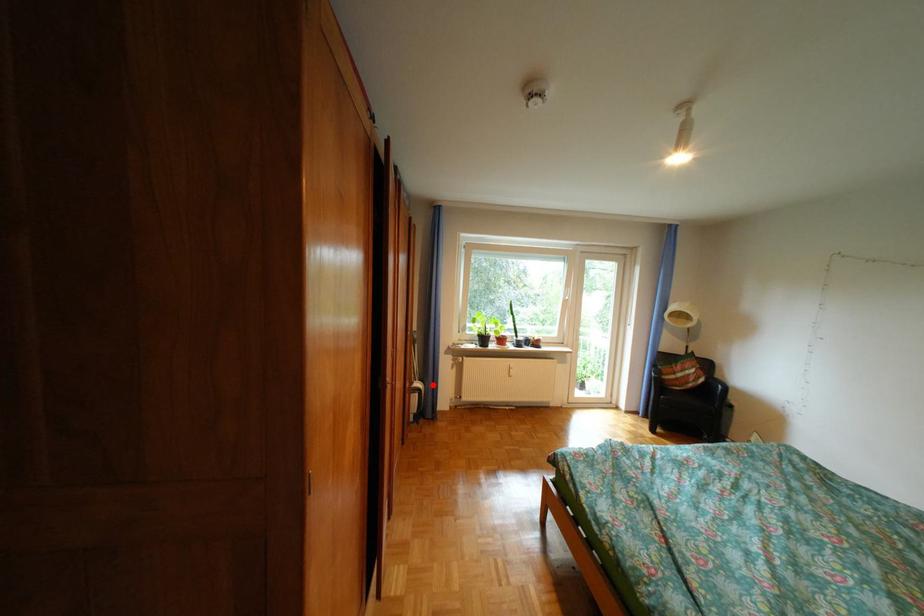
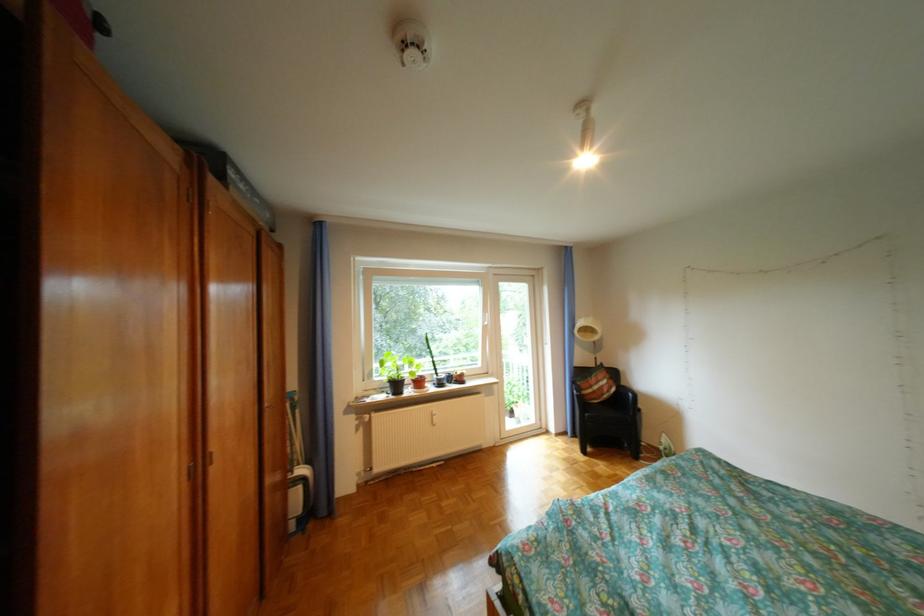
Find the pixel in the second image that matches the highlighted location in the first image.

(317, 471)